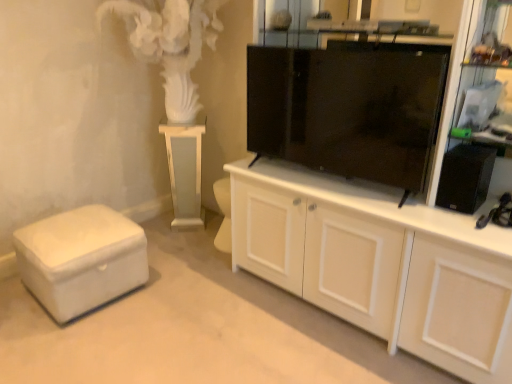
Question: Is black plastic speaker at right bigger or smaller than white leather ottoman at lower left?

Choices:
 (A) big
 (B) small

Answer: (B)

Question: From a real-world perspective, is black plastic speaker at right above or below white leather ottoman at lower left?

Choices:
 (A) below
 (B) above

Answer: (B)

Question: Which of these objects is positioned farthest from the black plastic speaker at right?

Choices:
 (A) white wood cabinet at center
 (B) white leather ottoman at lower left
 (C) white glossy pedestal at center
 (D) black glossy tv cabinet at center

Answer: (B)

Question: Estimate the real-world distances between objects in this image. Which object is farther from the white wood cabinet at center?

Choices:
 (A) white leather ottoman at lower left
 (B) black glossy tv cabinet at center
 (C) black plastic speaker at right
 (D) white glossy pedestal at center

Answer: (D)